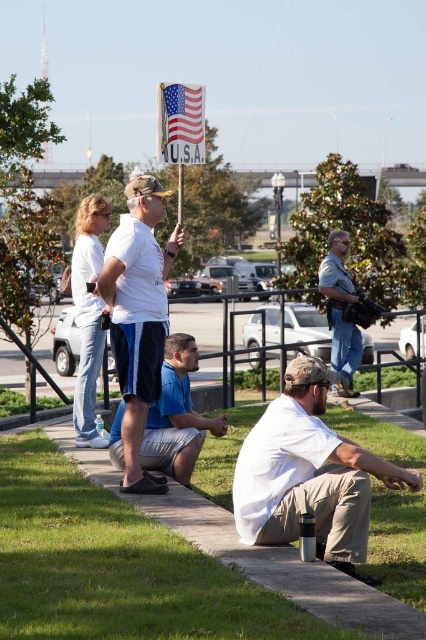
You are a photographer trying to capture a photo of the green grass at lower center and denim jeans at center in the same frame. Based on the scene description, can you fit both subjects into your camera viewfinder without moving your position?

The green grass at lower center and denim jeans at center are 8.88 meters apart from each other. Since the distance between them is quite large, you may need to adjust your camera angle or move closer to ensure both subjects are within the frame.

You are a photographer setting up a tripod to capture a group photo of the people at the event. The tripod requires a stable, flat surface. Based on the scene, which object between the green grass at lower center and the denim jeans at center would be more suitable for placing the tripod?

The denim jeans at center are taller than the green grass at lower center, so placing the tripod on the denim jeans at center might not be stable since it is elevated. The green grass at lower center, being shorter, would provide a more level and secure base for the tripod.